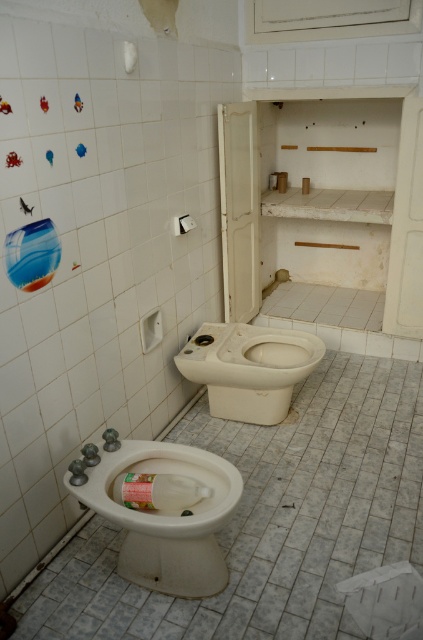
Can you confirm if white glossy toilet bowl at lower left is wider than white glossy toilet bowl at center?

In fact, white glossy toilet bowl at lower left might be narrower than white glossy toilet bowl at center.

Which is behind, point (150, 464) or point (280, 371)?

The point (280, 371) is behind.

Where is `white glossy toilet bowl at lower left`? The image size is (423, 640). white glossy toilet bowl at lower left is located at coordinates (167, 516).